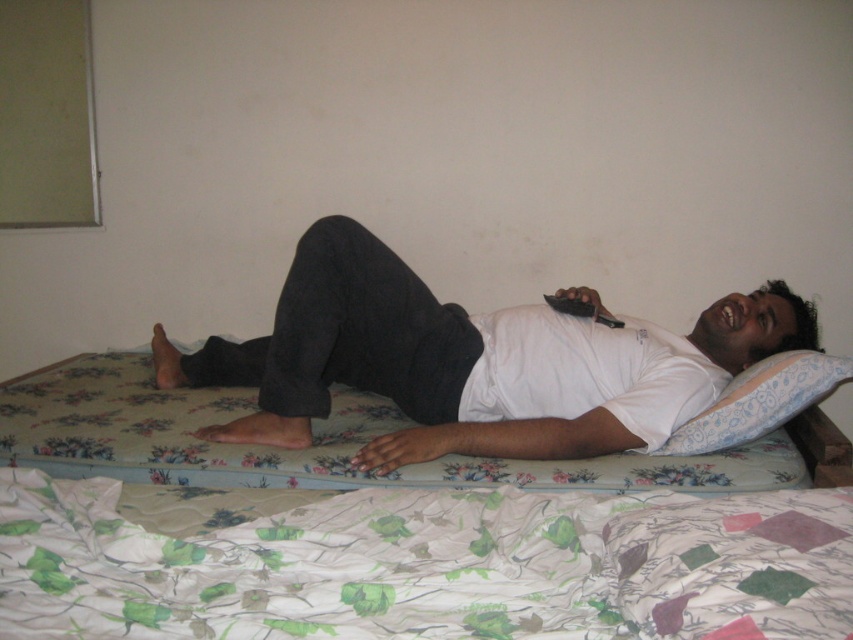
Is point (428, 470) farther from viewer compared to point (807, 380)?

No, (428, 470) is in front of (807, 380).

Consider the image. Does floral fabric mattress at center come in front of floral fabric pillow at upper right?

Yes, it is.

Identify the location of floral fabric mattress at center. The image size is (853, 640). tap(305, 449).

In the scene shown: Can you confirm if green floral fabric at lower center is thinner than floral fabric pillow at upper right?

Incorrect, green floral fabric at lower center's width is not less than floral fabric pillow at upper right's.

Is point (120, 580) in front of point (761, 388)?

Yes, it is in front of point (761, 388).

The height and width of the screenshot is (640, 853). Find the location of `green floral fabric at lower center`. green floral fabric at lower center is located at coordinates (418, 563).

How distant is green floral fabric at lower center from white matte shirt at center?

A distance of 22.60 inches exists between green floral fabric at lower center and white matte shirt at center.

Does green floral fabric at lower center appear on the left side of white matte shirt at center?

Indeed, green floral fabric at lower center is positioned on the left side of white matte shirt at center.

This screenshot has width=853, height=640. In order to click on green floral fabric at lower center in this screenshot , I will do `click(418, 563)`.

The height and width of the screenshot is (640, 853). I want to click on green floral fabric at lower center, so click(418, 563).